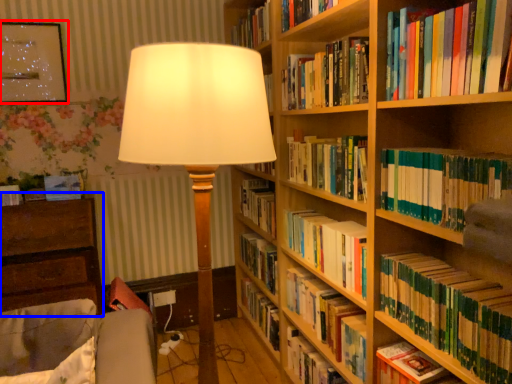
Question: Which of the following is the farthest to the observer, picture frame (highlighted by a red box) or chest of drawers (highlighted by a blue box)?

Choices:
 (A) picture frame
 (B) chest of drawers

Answer: (A)